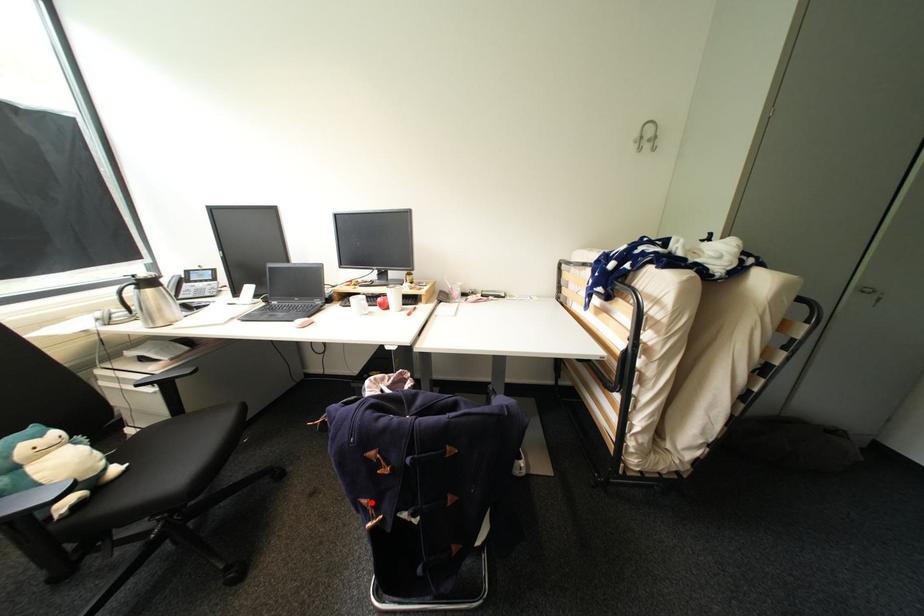
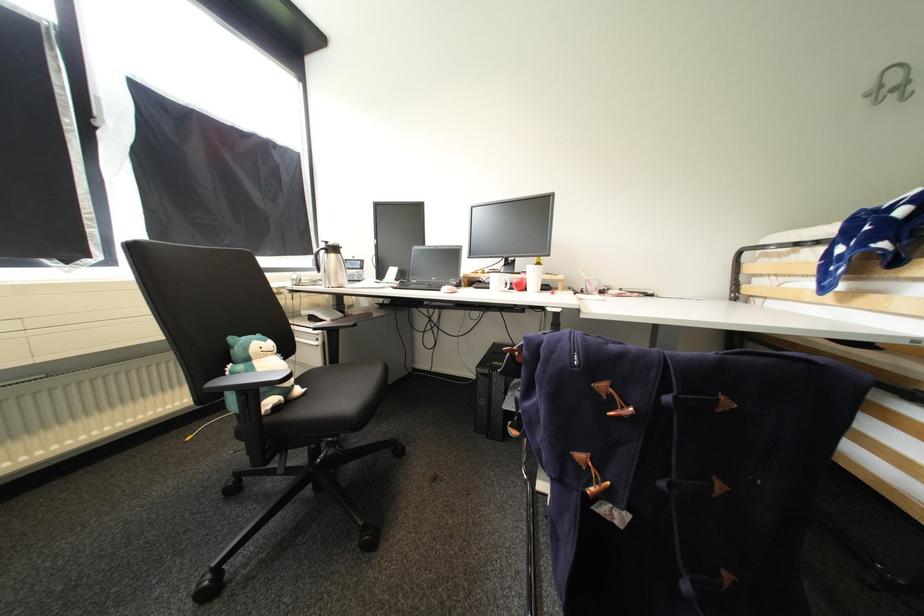
In the second image, find the point that corresponds to the highlighted location in the first image.

(588, 458)